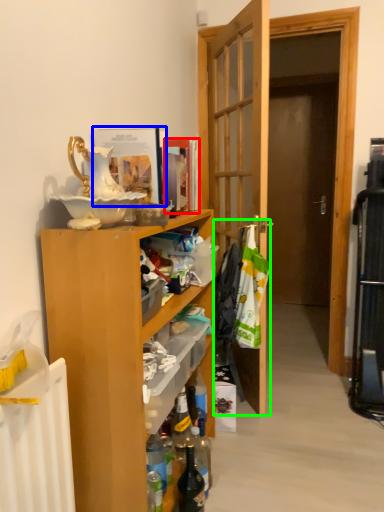
Question: Which object is positioned farthest from magazine (highlighted by a red box)? Select from magazine (highlighted by a blue box) and laundry (highlighted by a green box).

Choices:
 (A) magazine
 (B) laundry

Answer: (B)